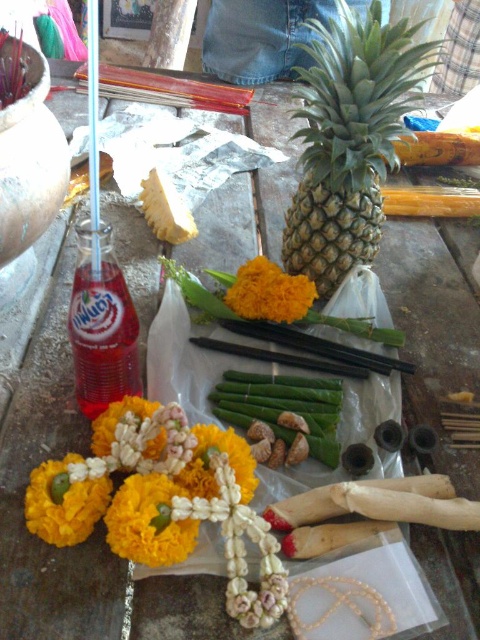
Question: Among these objects, which one is farthest from the camera?

Choices:
 (A) green asparagus at center
 (B) translucent plastic bottle at upper left

Answer: (A)

Question: Estimate the real-world distances between objects in this image. Which object is farther from the green textured pineapple at center?

Choices:
 (A) yellow fabric flower at lower left
 (B) orange matte flower at center
 (C) green asparagus at center

Answer: (A)

Question: Does green asparagus at center appear over yellow fabric flower at lower left?

Choices:
 (A) no
 (B) yes

Answer: (B)

Question: Does yellow fabric flower at lower left appear over orange matte flower at center?

Choices:
 (A) yes
 (B) no

Answer: (B)

Question: Estimate the real-world distances between objects in this image. Which object is farther from the green textured pineapple at center?

Choices:
 (A) translucent plastic bottle at upper left
 (B) yellow fabric garland at center
 (C) orange matte flower at center
 (D) green asparagus at center

Answer: (B)

Question: Can you confirm if green textured pineapple at center is positioned below translucent plastic bottle at upper left?

Choices:
 (A) no
 (B) yes

Answer: (A)